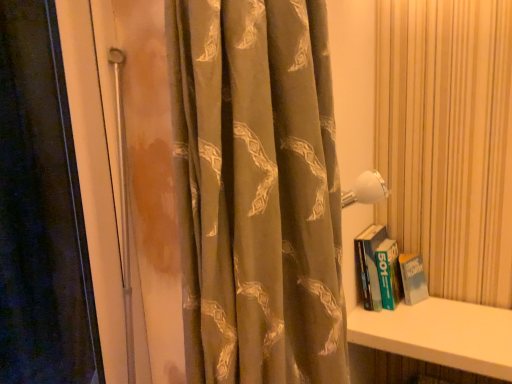
Question: Is green matte book at right in front of or behind silky brown curtain at center in the image?

Choices:
 (A) front
 (B) behind

Answer: (B)

Question: Is green matte book at right bigger or smaller than silky brown curtain at center?

Choices:
 (A) small
 (B) big

Answer: (A)

Question: Which object is positioned closest to the green matte book at right?

Choices:
 (A) silky brown curtain at center
 (B) white smooth shelf at lower right

Answer: (B)

Question: Which object is positioned farthest from the silky brown curtain at center?

Choices:
 (A) white smooth shelf at lower right
 (B) green matte book at right

Answer: (B)